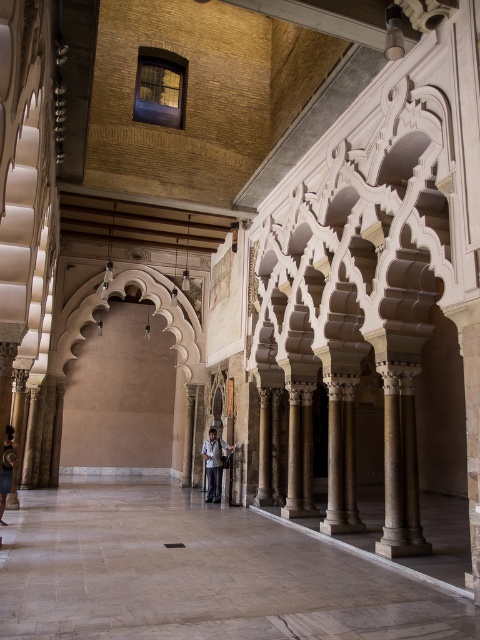
Question: Among these objects, which one is nearest to the camera?

Choices:
 (A) brown marble corridor at center
 (B) dark gray fabric at lower left
 (C) dark gray fabric jacket at center

Answer: (A)

Question: Which point is closer to the camera?

Choices:
 (A) dark gray fabric at lower left
 (B) dark gray fabric jacket at center
 (C) brown marble corridor at center

Answer: (C)

Question: Estimate the real-world distances between objects in this image. Which object is closer to the brown marble corridor at center?

Choices:
 (A) dark gray fabric jacket at center
 (B) dark gray fabric at lower left

Answer: (B)

Question: Is brown marble corridor at center smaller than dark gray fabric jacket at center?

Choices:
 (A) yes
 (B) no

Answer: (B)

Question: Can you confirm if brown marble corridor at center is positioned to the right of dark gray fabric at lower left?

Choices:
 (A) yes
 (B) no

Answer: (A)

Question: Can you confirm if brown marble corridor at center is positioned to the left of dark gray fabric at lower left?

Choices:
 (A) yes
 (B) no

Answer: (B)